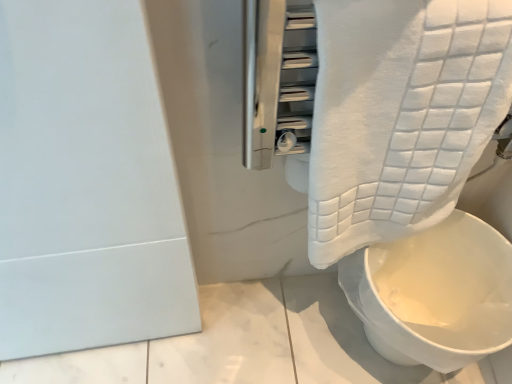
Question: Is white fabric toilet at lower right positioned behind white textured towel at upper right?

Choices:
 (A) no
 (B) yes

Answer: (B)

Question: From the image's perspective, does white fabric toilet at lower right appear lower than white textured towel at upper right?

Choices:
 (A) no
 (B) yes

Answer: (B)

Question: From a real-world perspective, is white fabric toilet at lower right over white textured towel at upper right?

Choices:
 (A) no
 (B) yes

Answer: (A)

Question: From the image's perspective, does white fabric toilet at lower right appear higher than white textured towel at upper right?

Choices:
 (A) yes
 (B) no

Answer: (B)

Question: Considering the relative sizes of white fabric toilet at lower right and white textured towel at upper right in the image provided, is white fabric toilet at lower right bigger than white textured towel at upper right?

Choices:
 (A) no
 (B) yes

Answer: (B)

Question: Can you confirm if white fabric toilet at lower right is wider than white textured towel at upper right?

Choices:
 (A) yes
 (B) no

Answer: (A)

Question: Is white textured towel at upper right at the right side of white fabric toilet at lower right?

Choices:
 (A) yes
 (B) no

Answer: (B)

Question: Is the depth of white textured towel at upper right greater than that of white fabric toilet at lower right?

Choices:
 (A) no
 (B) yes

Answer: (A)

Question: Could you tell me if white textured towel at upper right is facing white fabric toilet at lower right?

Choices:
 (A) no
 (B) yes

Answer: (A)

Question: Considering the relative sizes of white textured towel at upper right and white fabric toilet at lower right in the image provided, is white textured towel at upper right thinner than white fabric toilet at lower right?

Choices:
 (A) no
 (B) yes

Answer: (B)

Question: Considering the relative sizes of white textured towel at upper right and white fabric toilet at lower right in the image provided, is white textured towel at upper right taller than white fabric toilet at lower right?

Choices:
 (A) no
 (B) yes

Answer: (B)

Question: Does white textured towel at upper right lie in front of white fabric toilet at lower right?

Choices:
 (A) yes
 (B) no

Answer: (A)

Question: Considering their positions, is white textured towel at upper right located in front of or behind white fabric toilet at lower right?

Choices:
 (A) front
 (B) behind

Answer: (A)